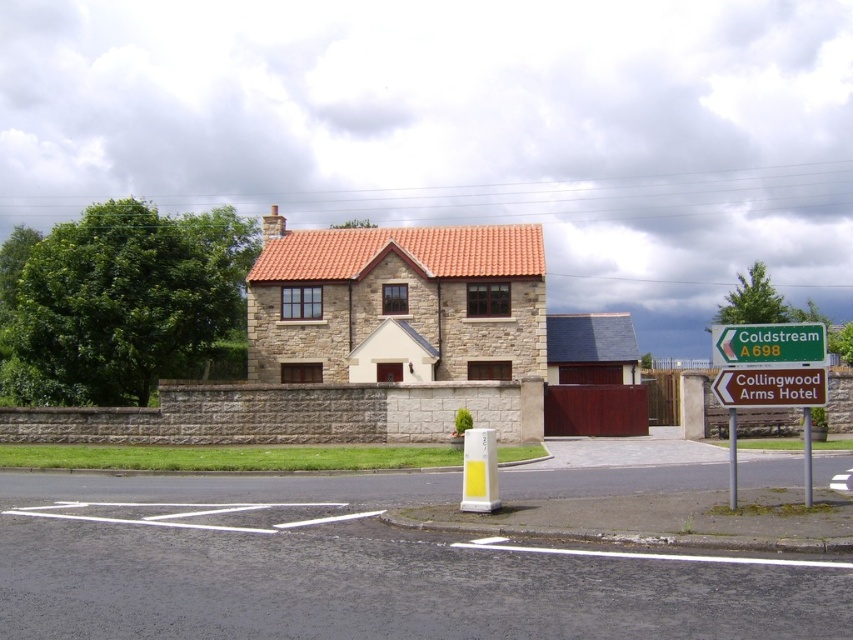
You are standing in front of the house and notice two points marked on the facade. The first point is at coordinates point (781, 339) and the second is at point (766, 390). Which point is closer to your current position?

Point (781, 339) is closer to the camera than point (766, 390), so the first point is closer to your current position.